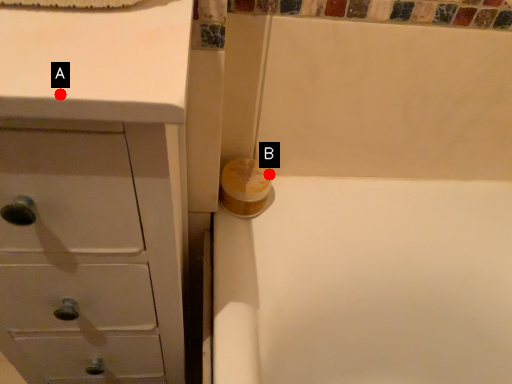
Question: Two points are circled on the image, labeled by A and B beside each circle. Which point appears closest to the camera in this image?

Choices:
 (A) A is closer
 (B) B is closer

Answer: (A)